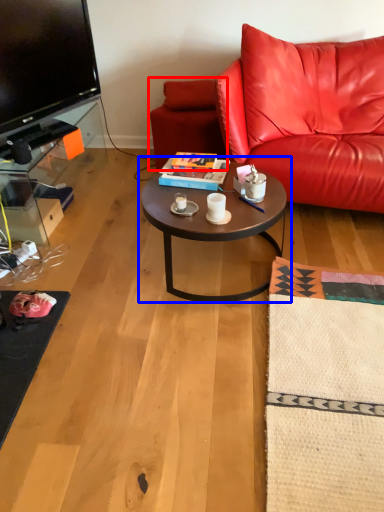
Question: Which of the following is the closest to the observer, swivel chair (highlighted by a red box) or coffee table (highlighted by a blue box)?

Choices:
 (A) swivel chair
 (B) coffee table

Answer: (B)